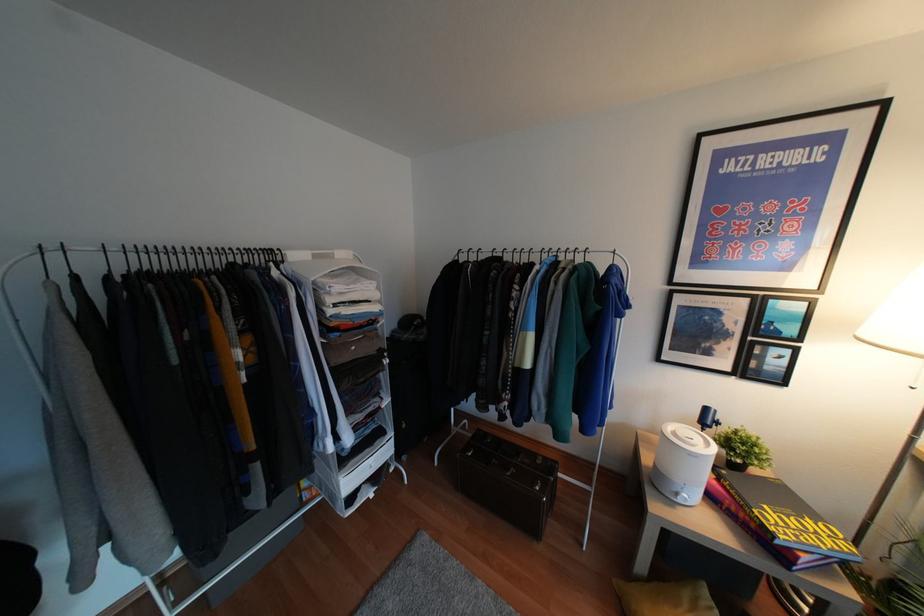
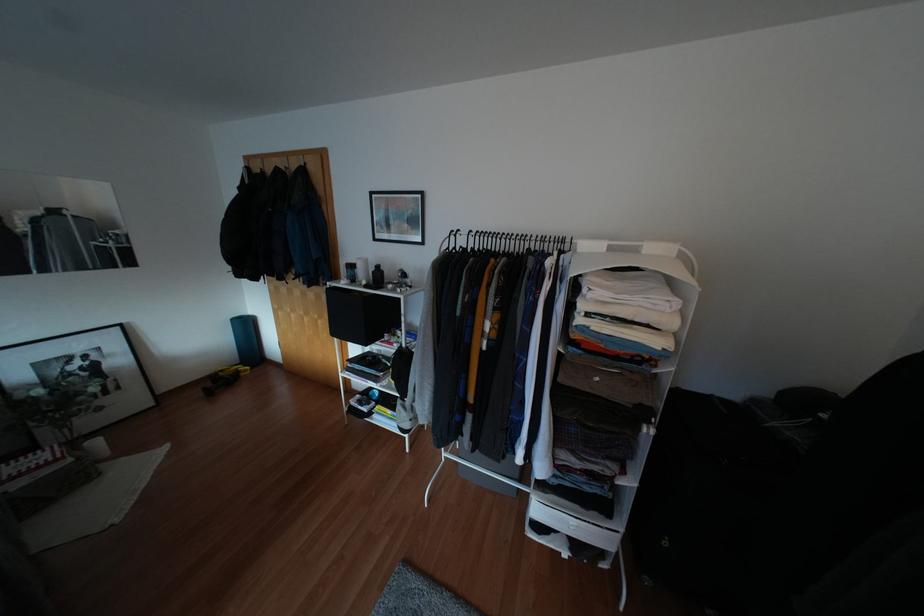
Question: How did the camera likely rotate?

Choices:
 (A) Left
 (B) Right
 (C) Up
 (D) Down

Answer: (A)